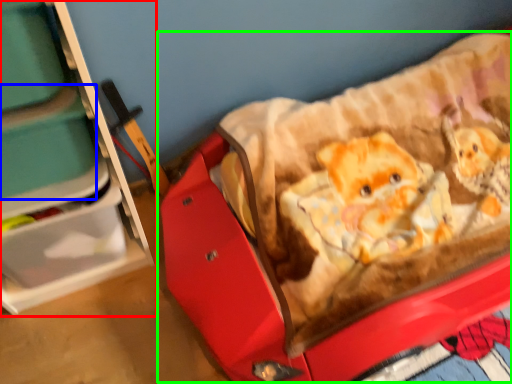
Question: Which object is positioned farthest from furniture (highlighted by a red box)? Select from storage box (highlighted by a blue box) and baby carriage (highlighted by a green box).

Choices:
 (A) storage box
 (B) baby carriage

Answer: (B)